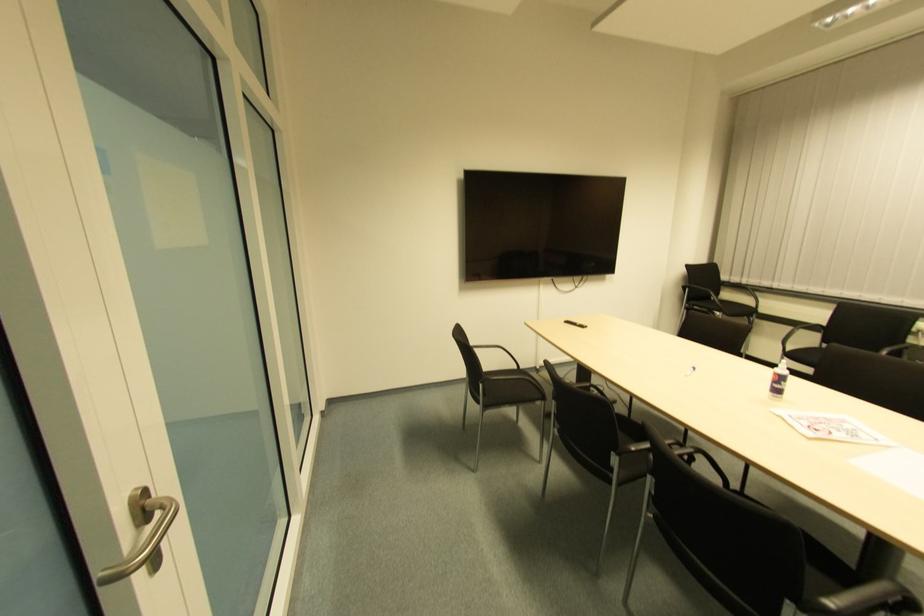
Identify the location of black remote control. This screenshot has height=616, width=924. 575,323.